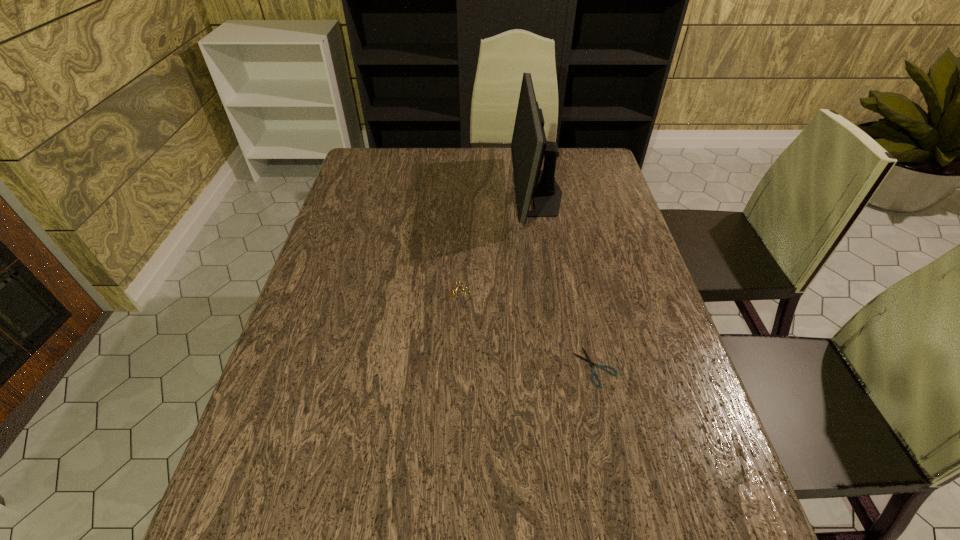
This screenshot has width=960, height=540. What are the coordinates of `free space between the farthest object and the farther shears` in the screenshot? It's located at (496, 243).

Locate an element on the screen. This screenshot has width=960, height=540. empty location between the tallest object and the taller shears is located at coordinates (496, 243).

At what (x,y) coordinates should I click in order to perform the action: click on vacant area that lies between the left shears and the computer monitor. Please return your answer as a coordinate pair (x, y). Image resolution: width=960 pixels, height=540 pixels. Looking at the image, I should click on (496, 243).

This screenshot has width=960, height=540. I want to click on unoccupied area between the nearest object and the left shears, so click(x=525, y=330).

Identify the location of free spot between the second shortest object and the tallest object. Image resolution: width=960 pixels, height=540 pixels. (496, 243).

Locate an element on the screen. The height and width of the screenshot is (540, 960). vacant area that lies between the second shortest object and the shortest object is located at coordinates (525, 330).

At what (x,y) coordinates should I click in order to perform the action: click on free area in between the shorter shears and the left shears. Please return your answer as a coordinate pair (x, y). Looking at the image, I should click on (525, 330).

Image resolution: width=960 pixels, height=540 pixels. In order to click on object that ranks as the closest to the farthest object in this screenshot , I will do `click(454, 293)`.

This screenshot has width=960, height=540. In order to click on object identified as the closest to the second farthest object in this screenshot , I will do `click(529, 146)`.

Identify the location of free space that satisfies the following two spatial constraints: 1. on the screen side of the right shears; 2. on the right side of the tallest object. point(565,367).